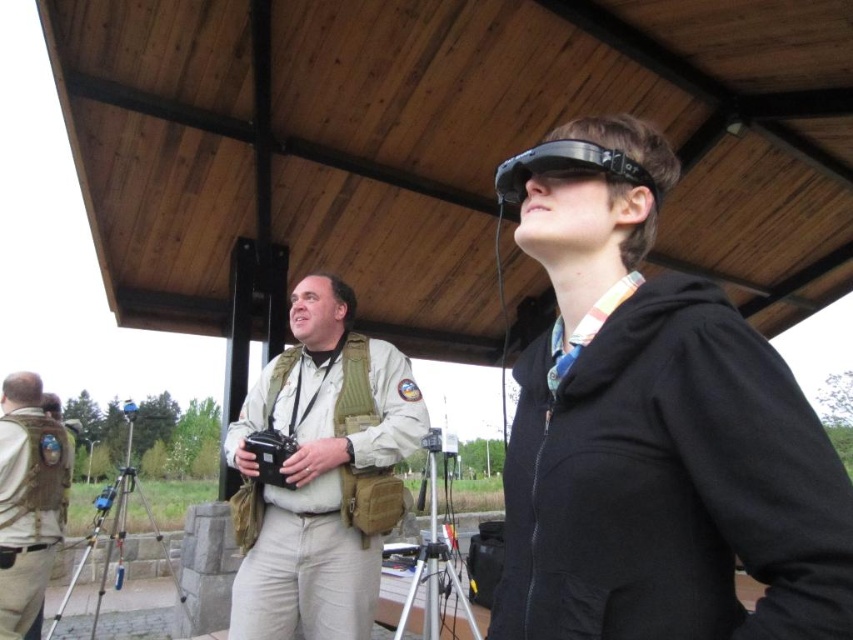
Who is lower down, black matte vr headset at upper right or blue plastic tripod at lower left?

blue plastic tripod at lower left is below.

Is black matte vr headset at upper right further to the viewer compared to blue plastic tripod at lower left?

No, black matte vr headset at upper right is in front of blue plastic tripod at lower left.

Locate an element on the screen. black matte vr headset at upper right is located at coordinates (653, 429).

The width and height of the screenshot is (853, 640). What do you see at coordinates (653, 429) in the screenshot?
I see `black matte vr headset at upper right` at bounding box center [653, 429].

Does point (653, 556) come closer to viewer compared to point (515, 180)?

Yes, point (653, 556) is in front of point (515, 180).

Identify the location of black matte vr headset at upper right. The image size is (853, 640). (653, 429).

Does blue plastic tripod at lower left lie in front of silver metallic tripod at lower center?

No, blue plastic tripod at lower left is further to the viewer.

Locate an element on the screen. This screenshot has width=853, height=640. blue plastic tripod at lower left is located at coordinates [x=115, y=531].